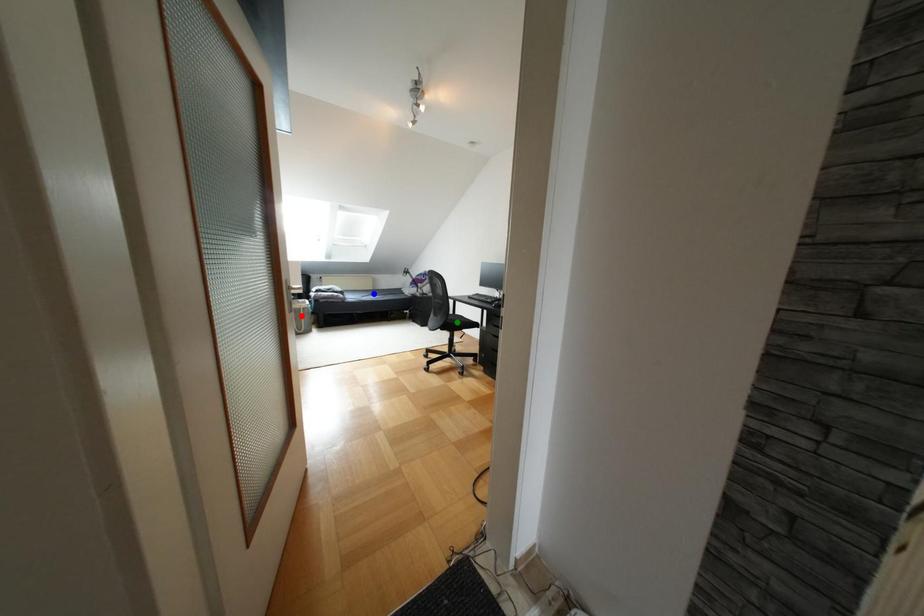
Order these from farthest to nearest:
green point | blue point | red point

blue point < red point < green point